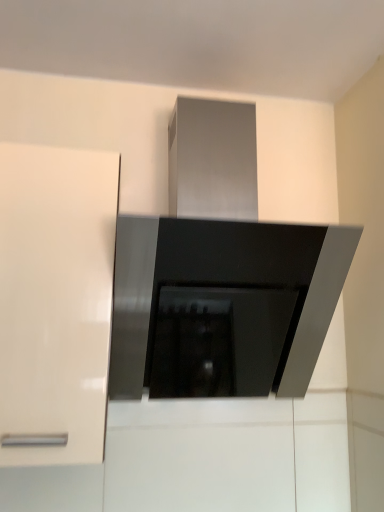
Find the location of `white glossy cabinet at left`. white glossy cabinet at left is located at coordinates (55, 298).

Describe the element at coordinates (55, 298) in the screenshot. I see `white glossy cabinet at left` at that location.

Find the location of `white glossy cabinet at left`. white glossy cabinet at left is located at coordinates (55, 298).